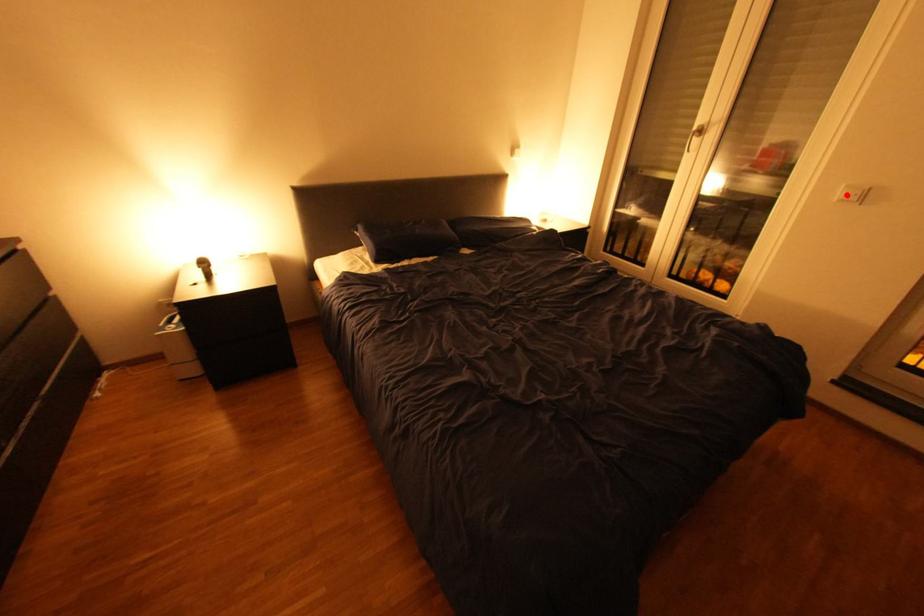
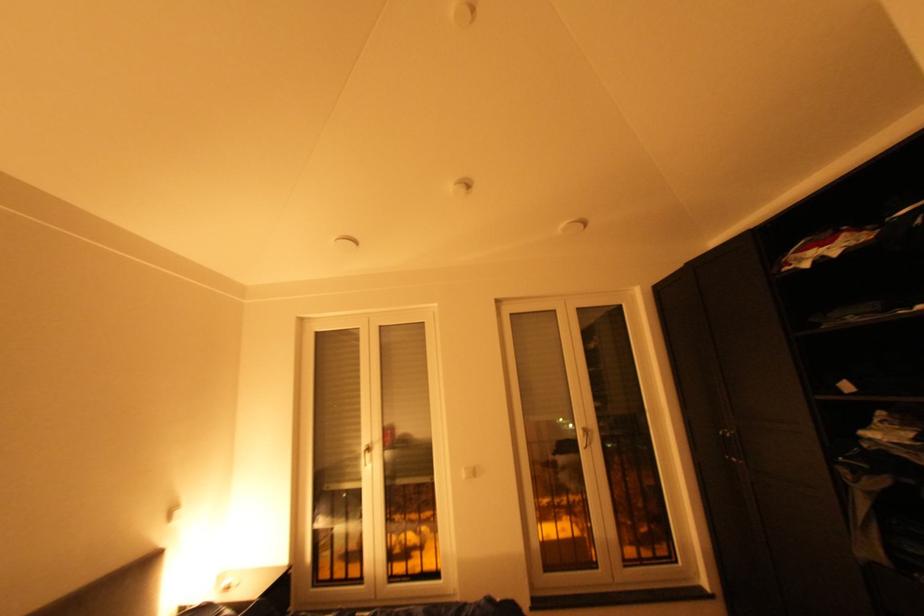
Locate, in the second image, the point that corresponds to the highlighted location in the first image.

(473, 476)